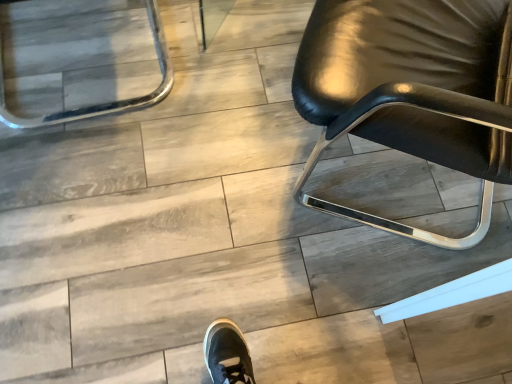
Measure the distance between point (461, 107) and camera.

A distance of 27.83 inches exists between point (461, 107) and camera.

Where is `glossy black chair at right, the 2th chair in the left-to-right sequence`? This screenshot has height=384, width=512. glossy black chair at right, the 2th chair in the left-to-right sequence is located at coordinates (411, 91).

What do you see at coordinates (411, 91) in the screenshot?
I see `glossy black chair at right, which is counted as the first chair, starting from the right` at bounding box center [411, 91].

What do you see at coordinates (108, 103) in the screenshot? This screenshot has height=384, width=512. I see `clear glass tray at upper left, placed as the 2th chair when sorted from right to left` at bounding box center [108, 103].

Find the location of a particular element. Image resolution: width=512 pixels, height=384 pixels. clear glass tray at upper left, which is the first chair from left to right is located at coordinates (108, 103).

This screenshot has height=384, width=512. What are the coordinates of `glossy black chair at right, which is counted as the first chair, starting from the right` in the screenshot? It's located at (411, 91).

Between clear glass tray at upper left, placed as the 2th chair when sorted from right to left, and glossy black chair at right, the 2th chair in the left-to-right sequence, which one appears on the left side from the viewer's perspective?

Positioned to the left is clear glass tray at upper left, placed as the 2th chair when sorted from right to left.

Which object is further away from the camera, clear glass tray at upper left, which is the first chair from left to right, or glossy black chair at right, which is counted as the first chair, starting from the right?

clear glass tray at upper left, which is the first chair from left to right.

Is point (97, 106) in front of point (337, 0)?

No.

From the image's perspective, is clear glass tray at upper left, which is the first chair from left to right, below glossy black chair at right, which is counted as the first chair, starting from the right?

No, from the image's perspective, clear glass tray at upper left, which is the first chair from left to right, is not beneath glossy black chair at right, which is counted as the first chair, starting from the right.

From a real-world perspective, between clear glass tray at upper left, placed as the 2th chair when sorted from right to left, and glossy black chair at right, the 2th chair in the left-to-right sequence, who is vertically higher?

In real-world perspective, glossy black chair at right, the 2th chair in the left-to-right sequence, is above.

Can you confirm if clear glass tray at upper left, which is the first chair from left to right, is wider than glossy black chair at right, which is counted as the first chair, starting from the right?

No.

Who is shorter, clear glass tray at upper left, placed as the 2th chair when sorted from right to left, or glossy black chair at right, the 2th chair in the left-to-right sequence?

clear glass tray at upper left, placed as the 2th chair when sorted from right to left.

Which of these two, clear glass tray at upper left, placed as the 2th chair when sorted from right to left, or glossy black chair at right, which is counted as the first chair, starting from the right, is smaller?

Smaller between the two is clear glass tray at upper left, placed as the 2th chair when sorted from right to left.

Is clear glass tray at upper left, which is the first chair from left to right, not within glossy black chair at right, the 2th chair in the left-to-right sequence?

Absolutely, clear glass tray at upper left, which is the first chair from left to right, is external to glossy black chair at right, the 2th chair in the left-to-right sequence.

Is clear glass tray at upper left, placed as the 2th chair when sorted from right to left, far from glossy black chair at right, which is counted as the first chair, starting from the right?

No, clear glass tray at upper left, placed as the 2th chair when sorted from right to left, is in close proximity to glossy black chair at right, which is counted as the first chair, starting from the right.

Is clear glass tray at upper left, which is the first chair from left to right, turned away from glossy black chair at right, which is counted as the first chair, starting from the right?

No.

From the picture: Measure the distance between clear glass tray at upper left, which is the first chair from left to right, and glossy black chair at right, the 2th chair in the left-to-right sequence.

clear glass tray at upper left, which is the first chair from left to right, is 81.08 centimeters from glossy black chair at right, the 2th chair in the left-to-right sequence.

Where is `chair that appears in front of the clear glass tray at upper left, placed as the 2th chair when sorted from right to left`? chair that appears in front of the clear glass tray at upper left, placed as the 2th chair when sorted from right to left is located at coordinates (411, 91).

Is glossy black chair at right, which is counted as the first chair, starting from the right, to the left of clear glass tray at upper left, placed as the 2th chair when sorted from right to left, from the viewer's perspective?

In fact, glossy black chair at right, which is counted as the first chair, starting from the right, is to the right of clear glass tray at upper left, placed as the 2th chair when sorted from right to left.

Considering the positions of objects glossy black chair at right, the 2th chair in the left-to-right sequence, and clear glass tray at upper left, which is the first chair from left to right, in the image provided, who is behind, glossy black chair at right, the 2th chair in the left-to-right sequence, or clear glass tray at upper left, which is the first chair from left to right,?

clear glass tray at upper left, which is the first chair from left to right, is further away from the camera.

Considering the positions of point (307, 77) and point (85, 117), is point (307, 77) closer or farther from the camera than point (85, 117)?

Point (307, 77).

From the image's perspective, relative to clear glass tray at upper left, which is the first chair from left to right, is glossy black chair at right, which is counted as the first chair, starting from the right, above or below?

Clearly, from the image's perspective, glossy black chair at right, which is counted as the first chair, starting from the right, is below clear glass tray at upper left, which is the first chair from left to right.

From a real-world perspective, who is located lower, glossy black chair at right, the 2th chair in the left-to-right sequence, or clear glass tray at upper left, placed as the 2th chair when sorted from right to left?

clear glass tray at upper left, placed as the 2th chair when sorted from right to left, is physically lower.

Between glossy black chair at right, which is counted as the first chair, starting from the right, and clear glass tray at upper left, placed as the 2th chair when sorted from right to left, which one has smaller width?

Thinner between the two is clear glass tray at upper left, placed as the 2th chair when sorted from right to left.

Considering the sizes of objects glossy black chair at right, which is counted as the first chair, starting from the right, and clear glass tray at upper left, placed as the 2th chair when sorted from right to left, in the image provided, who is shorter, glossy black chair at right, which is counted as the first chair, starting from the right, or clear glass tray at upper left, placed as the 2th chair when sorted from right to left,?

Standing shorter between the two is clear glass tray at upper left, placed as the 2th chair when sorted from right to left.

Can you confirm if glossy black chair at right, which is counted as the first chair, starting from the right, is smaller than clear glass tray at upper left, placed as the 2th chair when sorted from right to left?

No.

Consider the image. Do you think glossy black chair at right, which is counted as the first chair, starting from the right, is within clear glass tray at upper left, placed as the 2th chair when sorted from right to left, or outside of it?

glossy black chair at right, which is counted as the first chair, starting from the right, is located beyond the bounds of clear glass tray at upper left, placed as the 2th chair when sorted from right to left.

Is glossy black chair at right, the 2th chair in the left-to-right sequence, far away from clear glass tray at upper left, which is the first chair from left to right?

No.

Is glossy black chair at right, the 2th chair in the left-to-right sequence, aimed at clear glass tray at upper left, which is the first chair from left to right?

Yes, glossy black chair at right, the 2th chair in the left-to-right sequence, faces towards clear glass tray at upper left, which is the first chair from left to right.

How different are the orientations of glossy black chair at right, which is counted as the first chair, starting from the right, and clear glass tray at upper left, which is the first chair from left to right, in degrees?

glossy black chair at right, which is counted as the first chair, starting from the right, and clear glass tray at upper left, which is the first chair from left to right, are facing 58.4 degrees away from each other.

This screenshot has height=384, width=512. Find the location of `chair on the left of the glossy black chair at right, which is counted as the first chair, starting from the right`. chair on the left of the glossy black chair at right, which is counted as the first chair, starting from the right is located at coordinates (108, 103).

Image resolution: width=512 pixels, height=384 pixels. I want to click on chair that appears behind the glossy black chair at right, which is counted as the first chair, starting from the right, so click(x=108, y=103).

Locate an element on the screen. The width and height of the screenshot is (512, 384). chair located underneath the glossy black chair at right, which is counted as the first chair, starting from the right (from a real-world perspective) is located at coordinates (108, 103).